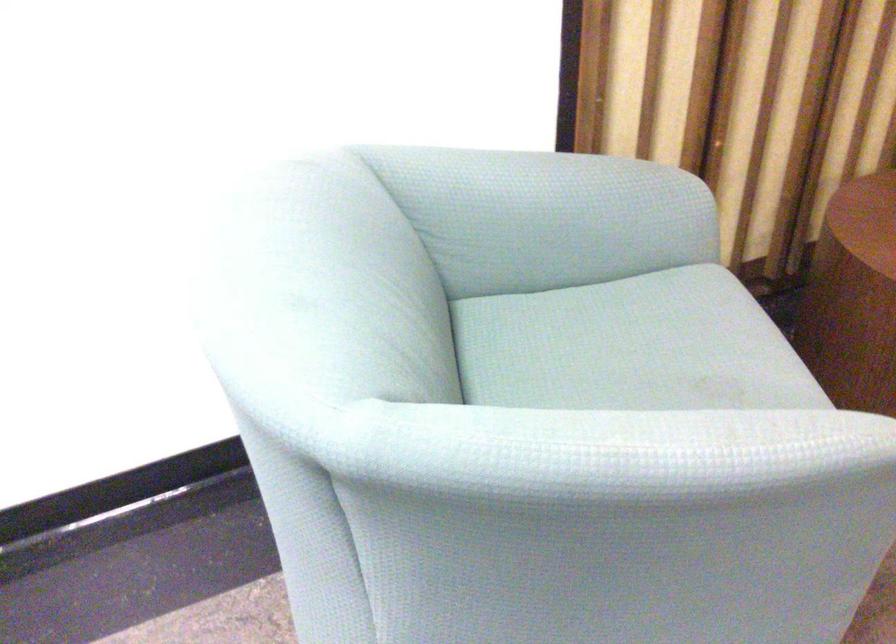
At what (x,y) coordinates should I click in order to perform the action: click on chair sitting surface. Please return your answer as a coordinate pair (x, y). This screenshot has height=644, width=896. Looking at the image, I should click on (631, 346).